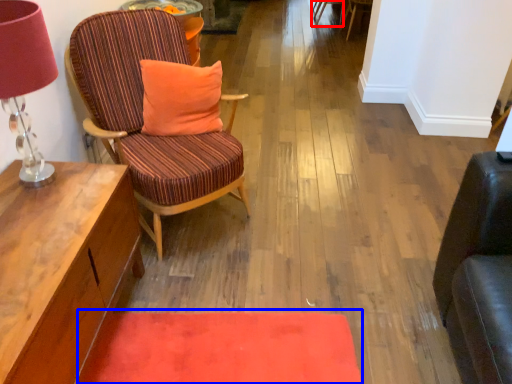
Question: Which object is further to the camera taking this photo, chair (highlighted by a red box) or mat (highlighted by a blue box)?

Choices:
 (A) chair
 (B) mat

Answer: (A)